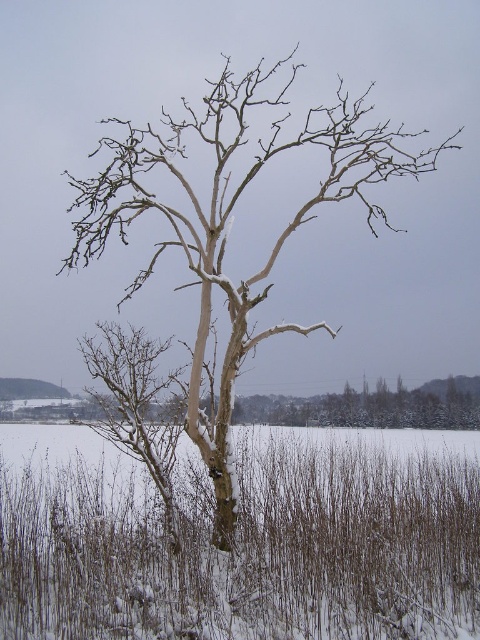
Question: Among these points, which one is nearest to the camera?

Choices:
 (A) (47, 461)
 (B) (122, 429)

Answer: (B)

Question: Is snowy grass at center positioned behind snow-covered bark tree at center?

Choices:
 (A) no
 (B) yes

Answer: (A)

Question: Does snowy grass at center lie in front of snow-covered bark tree at center?

Choices:
 (A) yes
 (B) no

Answer: (A)

Question: Which point is closer to the camera?

Choices:
 (A) (423, 156)
 (B) (122, 632)

Answer: (B)

Question: Can you confirm if snowy grass at center is positioned to the left of snow-covered bark tree at center?

Choices:
 (A) yes
 (B) no

Answer: (B)